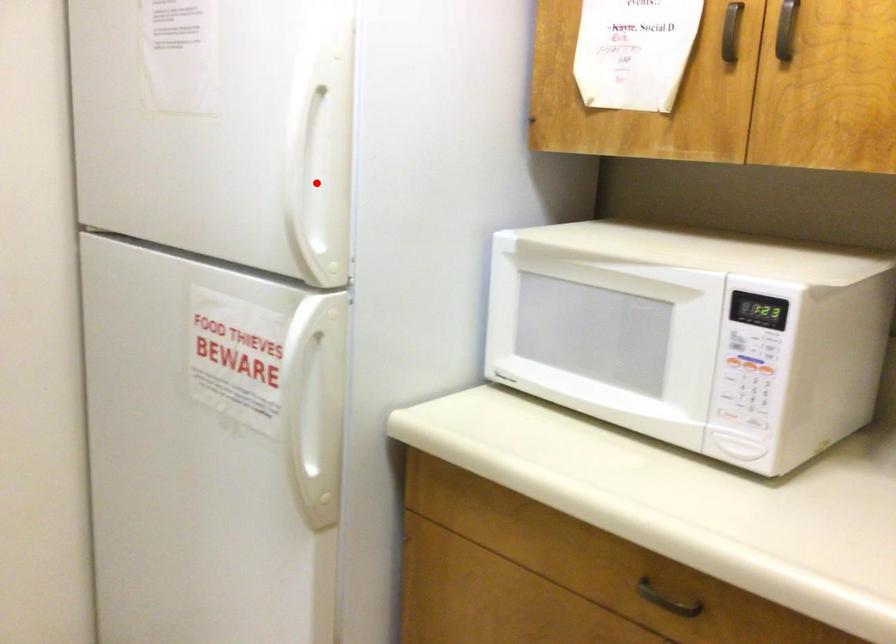
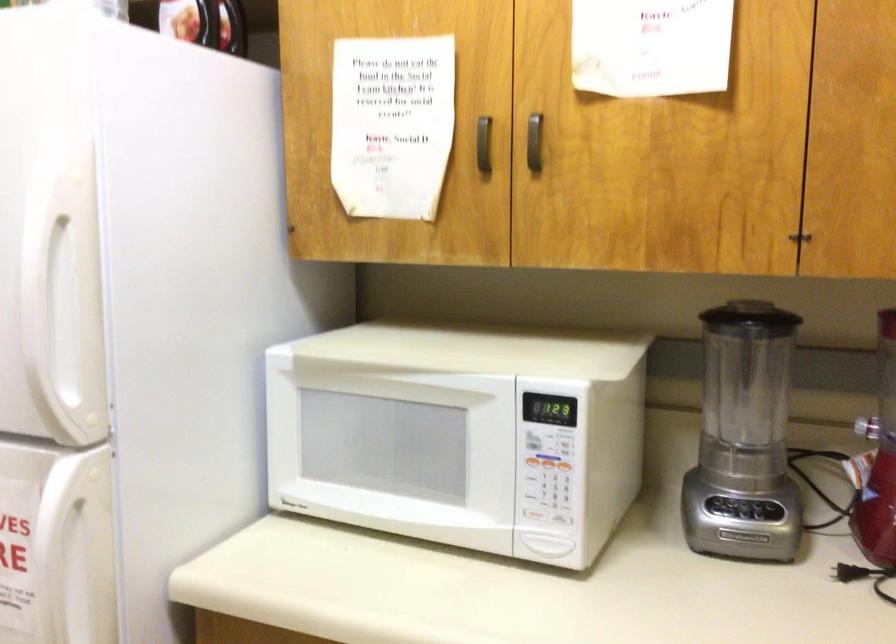
Find the pixel in the second image that matches the highlighted location in the first image.

(65, 327)